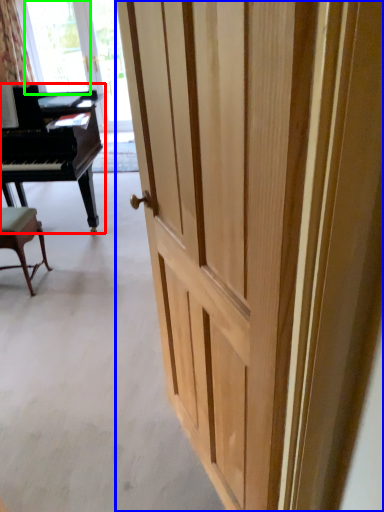
Question: Which object is positioned closest to piano (highlighted by a red box)? Select from door (highlighted by a blue box) and window screen (highlighted by a green box).

Choices:
 (A) door
 (B) window screen

Answer: (A)